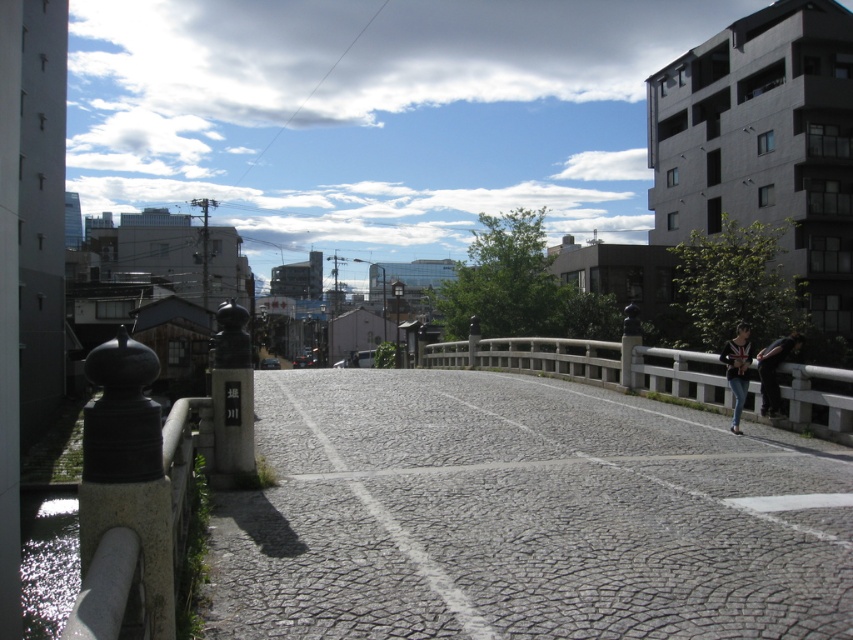
Question: Which object is closer to the camera taking this photo?

Choices:
 (A) denim jacket at right
 (B) dark gray fabric jacket at center right
 (C) white stone rail at right

Answer: (C)

Question: Where is white stone rail at right located in relation to denim jacket at right in the image?

Choices:
 (A) above
 (B) below

Answer: (A)

Question: Which point is closer to the camera taking this photo?

Choices:
 (A) (744, 342)
 (B) (692, 404)

Answer: (A)

Question: Which point is farther from the camera taking this photo?

Choices:
 (A) (679, 368)
 (B) (738, 412)

Answer: (A)

Question: Can you confirm if denim jacket at right is smaller than dark gray fabric jacket at center right?

Choices:
 (A) yes
 (B) no

Answer: (A)

Question: Is white stone rail at right in front of denim jacket at right?

Choices:
 (A) yes
 (B) no

Answer: (A)